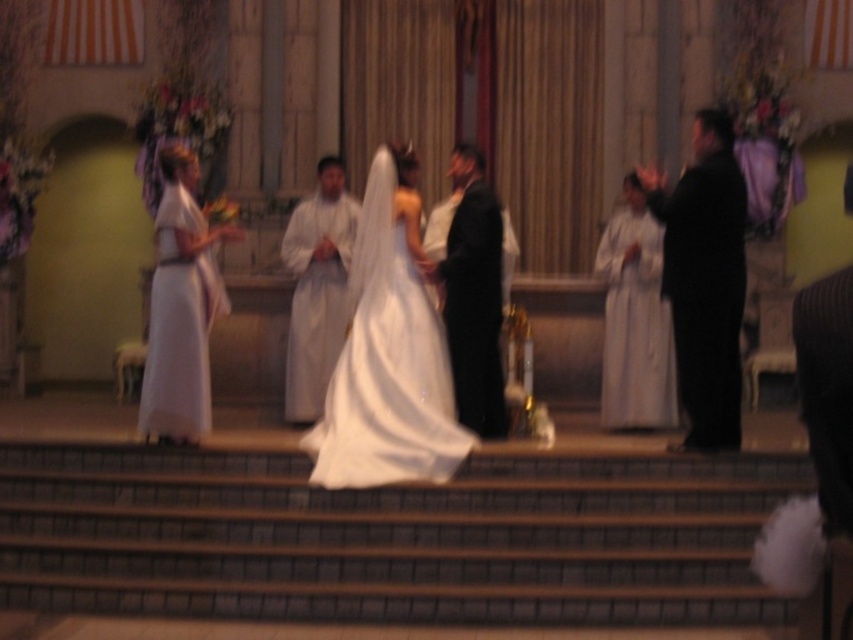
Question: Is shiny black suit at center above white matte robe at center?

Choices:
 (A) yes
 (B) no

Answer: (B)

Question: Which point is farther to the camera?

Choices:
 (A) (498, 225)
 (B) (663, 246)
 (C) (291, 221)

Answer: (C)

Question: Is black satin suit at right further to the viewer compared to white satin dress at left?

Choices:
 (A) no
 (B) yes

Answer: (B)

Question: Based on their relative distances, which object is nearer to the shiny black suit at center?

Choices:
 (A) white satin dress at right
 (B) white satin dress at center
 (C) white satin dress at left

Answer: (B)

Question: Which of the following is the farthest from the observer?

Choices:
 (A) shiny black suit at center
 (B) white matte robe at center
 (C) white satin dress at left
 (D) smooth stone stairs at center

Answer: (B)

Question: Is shiny black suit at center below white matte robe at center?

Choices:
 (A) no
 (B) yes

Answer: (B)